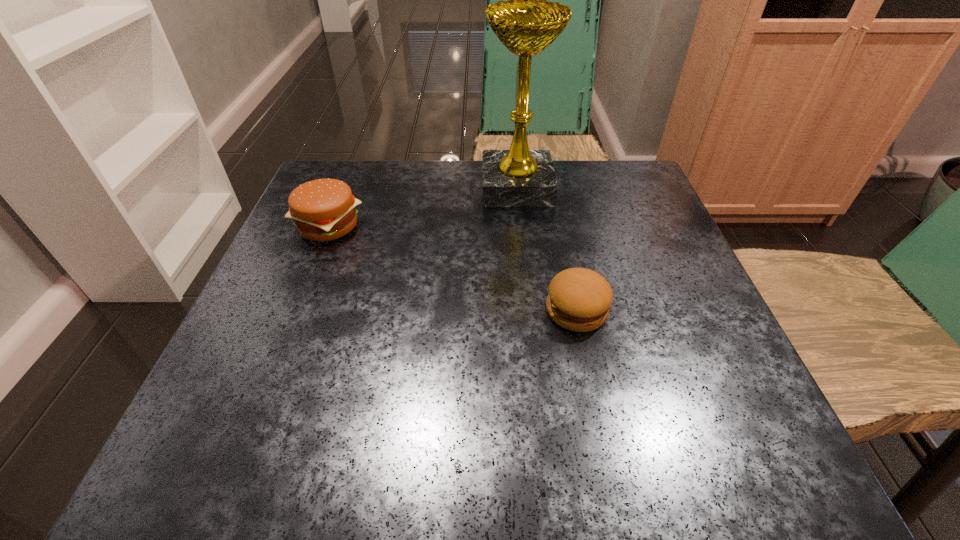
The height and width of the screenshot is (540, 960). What are the coordinates of `object that is the second closest one to the nearer hamburger` in the screenshot? It's located at (323, 209).

Identify which object is the second closest to the leftmost object. Please provide its 2D coordinates. Your answer should be formatted as a tuple, i.e. [(x, y)], where the tuple contains the x and y coordinates of a point satisfying the conditions above.

[(579, 299)]

This screenshot has width=960, height=540. I want to click on blank space that satisfies the following two spatial constraints: 1. on the front-facing side of the right hamburger; 2. on the left side of the tallest object, so click(530, 310).

This screenshot has width=960, height=540. In order to click on free space that satisfies the following two spatial constraints: 1. on the front-facing side of the right hamburger; 2. on the right side of the tallest object in this screenshot , I will do `click(530, 310)`.

Locate an element on the screen. This screenshot has width=960, height=540. free spot that satisfies the following two spatial constraints: 1. on the front-facing side of the nearest object; 2. on the right side of the award is located at coordinates (530, 310).

This screenshot has height=540, width=960. In order to click on blank space that satisfies the following two spatial constraints: 1. on the front-facing side of the tallest object; 2. on the left side of the nearer hamburger in this screenshot , I will do pyautogui.click(x=530, y=310).

Where is `vacant space that satisfies the following two spatial constraints: 1. on the front-facing side of the award; 2. on the front side of the left hamburger`? The height and width of the screenshot is (540, 960). vacant space that satisfies the following two spatial constraints: 1. on the front-facing side of the award; 2. on the front side of the left hamburger is located at coordinates (521, 226).

Where is `free spot that satisfies the following two spatial constraints: 1. on the front-facing side of the award; 2. on the back side of the shortest object`? Image resolution: width=960 pixels, height=540 pixels. free spot that satisfies the following two spatial constraints: 1. on the front-facing side of the award; 2. on the back side of the shortest object is located at coordinates (530, 310).